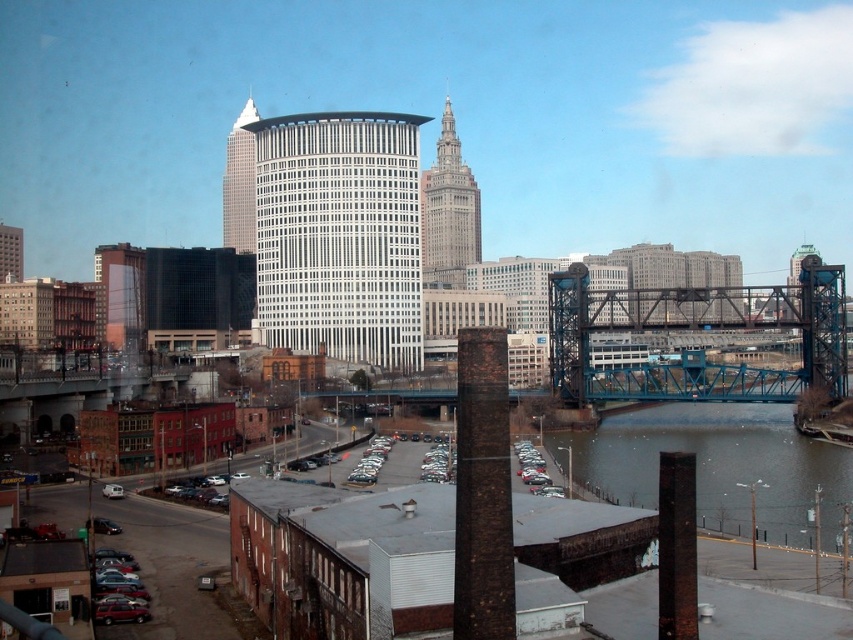
Question: Is brown brick tower at center thinner than silver metallic van at lower left?

Choices:
 (A) yes
 (B) no

Answer: (B)

Question: Among these objects, which one is nearest to the camera?

Choices:
 (A) white glass skyscraper at upper center
 (B) white glass building at center
 (C) blue metallic bridge at right

Answer: (C)

Question: Can you confirm if white glass building at center is smaller than brown brick tower at center?

Choices:
 (A) no
 (B) yes

Answer: (B)

Question: Which object is positioned farthest from the dark gray concrete waterway at lower right?

Choices:
 (A) brown brick tower at center
 (B) white glass building at center
 (C) blue metallic bridge at right

Answer: (A)

Question: Is the position of blue metallic bridge at right less distant than that of dark gray concrete waterway at lower right?

Choices:
 (A) yes
 (B) no

Answer: (B)

Question: Which point is farther to the camera?

Choices:
 (A) silver metallic van at lower left
 (B) brown brick tower at center

Answer: (B)